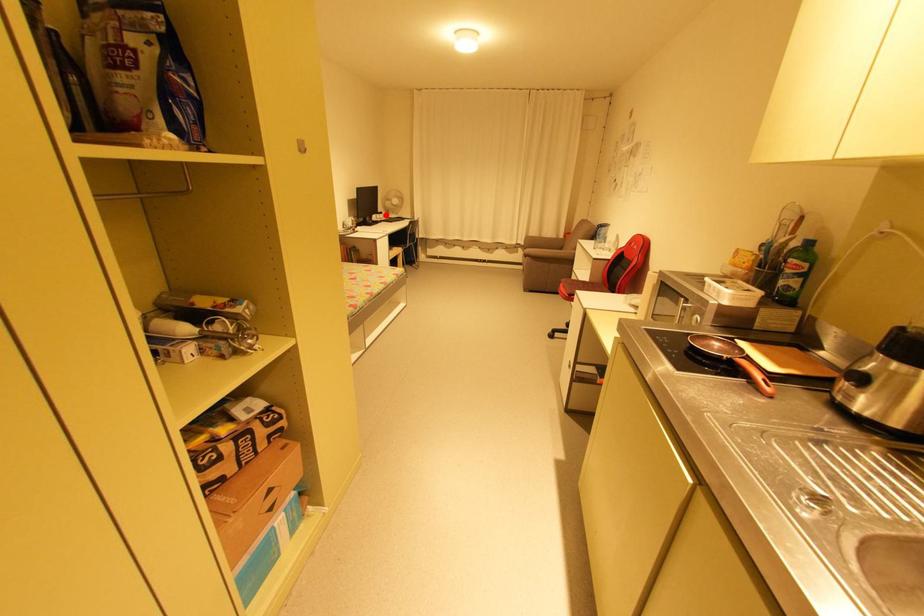
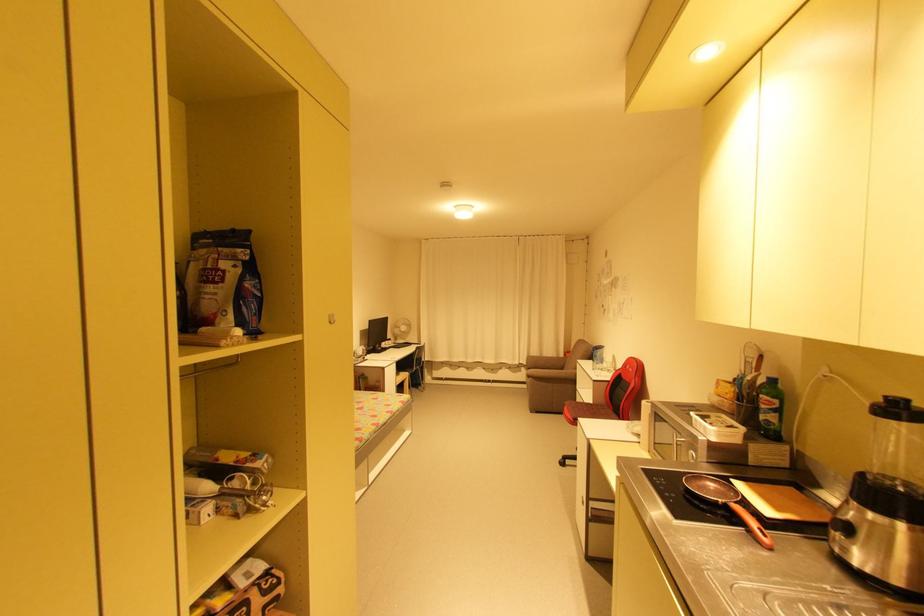
Find the pixel in the second image that matches the highlighted location in the first image.

(395, 342)